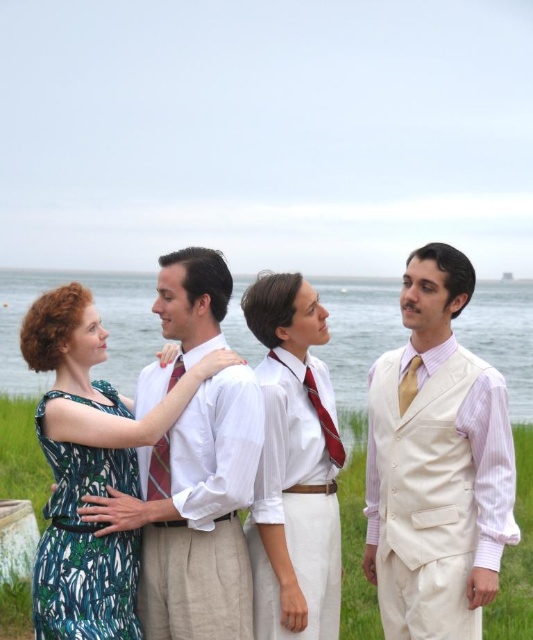
You are taking a photo of the scene and want to focus on both point (68, 512) and point (165, 440). Which point should you focus on first to ensure both are in sharp focus?

You should focus on point (68, 512) first because it is closer to the camera than point (165, 440), ensuring the depth of field captures both points clearly.

You are a photographer trying to capture a group photo of the green floral dress at left and the red silk tie at center. Since you want to ensure both subjects are in focus, you need to know which one is taller. Can you tell me which is taller?

The green floral dress at left is taller than the red silk tie at center, so you should adjust your camera settings to focus on the taller subject first.